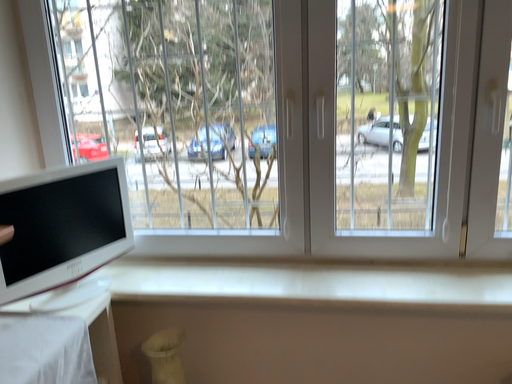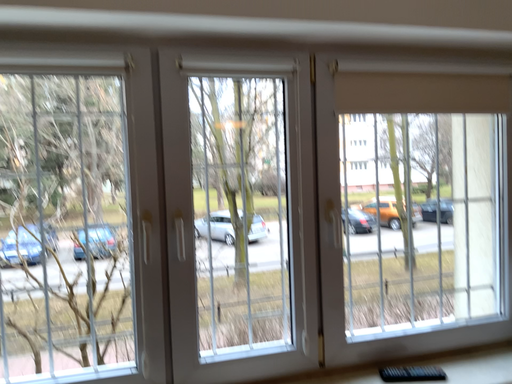
Question: Which way did the camera rotate in the video?

Choices:
 (A) rotated upward
 (B) rotated downward

Answer: (A)